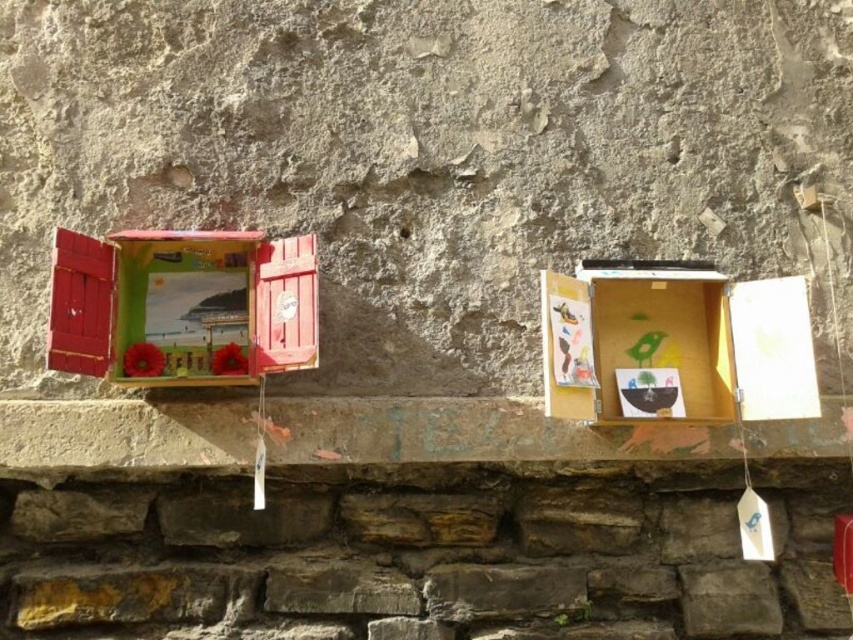
Question: Is matte wooden window at left to the left of matte wood shutter at left from the viewer's perspective?

Choices:
 (A) yes
 (B) no

Answer: (B)

Question: Is smooth stone ledge at center to the right of matte wood shutter at left from the viewer's perspective?

Choices:
 (A) no
 (B) yes

Answer: (B)

Question: Which of these objects is positioned farthest from the wooden box at center?

Choices:
 (A) matte wood shutter at left
 (B) smooth stone ledge at center

Answer: (A)

Question: Which point is farther to the camera?

Choices:
 (A) matte wood shutter at left
 (B) matte wooden window at left

Answer: (B)

Question: Which object is the farthest from the matte wooden window at left?

Choices:
 (A) matte wood shutter at left
 (B) wooden box at center
 (C) smooth stone ledge at center

Answer: (B)

Question: Does matte wooden window at left appear on the left side of matte wood shutter at left?

Choices:
 (A) yes
 (B) no

Answer: (B)